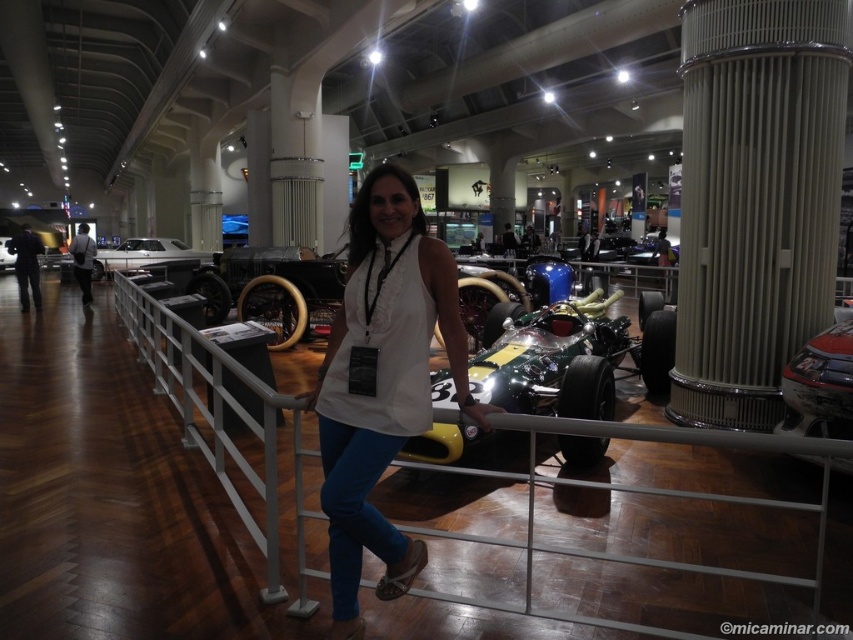
This screenshot has height=640, width=853. What do you see at coordinates (381, 381) in the screenshot?
I see `white fabric shirt at center` at bounding box center [381, 381].

Which is above, white fabric shirt at center or shiny metallic race car at center?

white fabric shirt at center is above.

Between point (454, 275) and point (503, 310), which one is positioned behind?

The point (503, 310) is behind.

This screenshot has width=853, height=640. I want to click on white fabric shirt at center, so click(x=381, y=381).

Based on the photo, does shiny red car at center have a larger size compared to shiny silver car at center?

Actually, shiny red car at center might be smaller than shiny silver car at center.

What do you see at coordinates (819, 385) in the screenshot? The image size is (853, 640). I see `shiny red car at center` at bounding box center [819, 385].

Locate an element on the screen. The height and width of the screenshot is (640, 853). shiny red car at center is located at coordinates (819, 385).

Between shiny metallic race car at center and shiny red car at center, which one has less height?

shiny red car at center

Which is in front, point (552, 355) or point (849, 330)?

Point (849, 330) is in front.

This screenshot has width=853, height=640. In order to click on shiny metallic race car at center in this screenshot , I will do `click(554, 356)`.